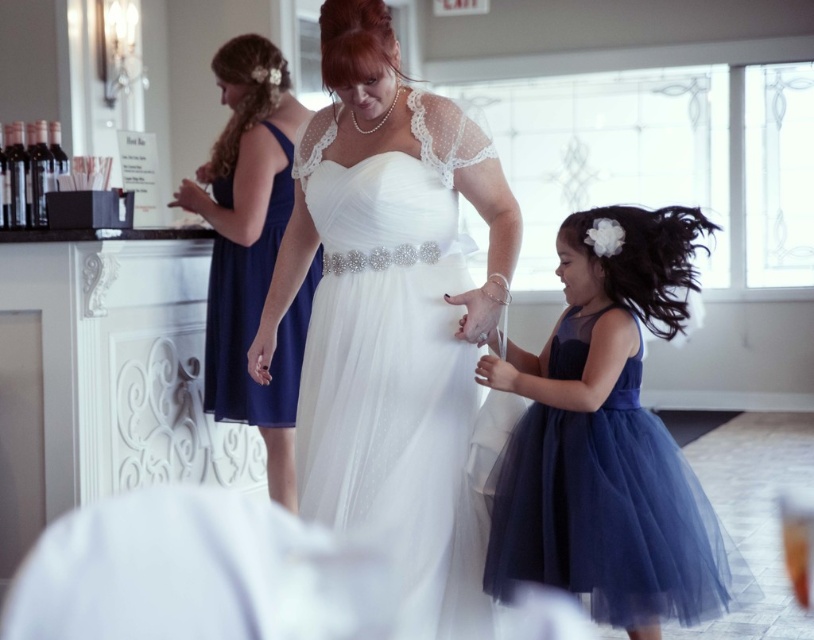
Question: Can you confirm if satin white gown at center is positioned above navy satin dress at upper left?

Choices:
 (A) no
 (B) yes

Answer: (A)

Question: Which point is closer to the camera?

Choices:
 (A) satin white gown at center
 (B) white lace dress at center
 (C) navy tulle dress at lower right

Answer: (C)

Question: Can you confirm if navy tulle dress at lower right is positioned to the left of navy satin dress at upper left?

Choices:
 (A) yes
 (B) no

Answer: (B)

Question: Which point is farther to the camera?

Choices:
 (A) satin white gown at center
 (B) navy tulle dress at lower right

Answer: (A)

Question: Which point is closer to the camera taking this photo?

Choices:
 (A) (436, 298)
 (B) (222, 292)
 (C) (524, 355)
 (D) (287, 324)

Answer: (A)

Question: Can you confirm if navy tulle dress at lower right is positioned to the left of white lace dress at center?

Choices:
 (A) no
 (B) yes

Answer: (A)